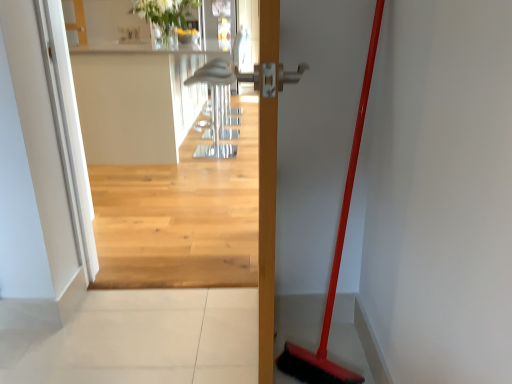
Question: Does white glossy vase at upper center lie in front of red plastic broom at right?

Choices:
 (A) no
 (B) yes

Answer: (A)

Question: Can you confirm if white glossy vase at upper center is thinner than red plastic broom at right?

Choices:
 (A) no
 (B) yes

Answer: (A)

Question: Does white glossy vase at upper center have a smaller size compared to red plastic broom at right?

Choices:
 (A) yes
 (B) no

Answer: (B)

Question: Can you see white glossy vase at upper center touching red plastic broom at right?

Choices:
 (A) yes
 (B) no

Answer: (B)

Question: Is white glossy vase at upper center bigger than red plastic broom at right?

Choices:
 (A) no
 (B) yes

Answer: (B)

Question: Can you confirm if white glossy vase at upper center is positioned to the left of red plastic broom at right?

Choices:
 (A) no
 (B) yes

Answer: (B)

Question: Considering the relative positions of red plastic broom at right and white glossy vase at upper center in the image provided, is red plastic broom at right behind white glossy vase at upper center?

Choices:
 (A) yes
 (B) no

Answer: (B)

Question: Is red plastic broom at right facing towards white glossy vase at upper center?

Choices:
 (A) no
 (B) yes

Answer: (A)

Question: Is white glossy vase at upper center at the back of red plastic broom at right?

Choices:
 (A) yes
 (B) no

Answer: (B)

Question: Is the position of red plastic broom at right less distant than that of white glossy vase at upper center?

Choices:
 (A) yes
 (B) no

Answer: (A)

Question: Would you say red plastic broom at right is outside white glossy vase at upper center?

Choices:
 (A) yes
 (B) no

Answer: (A)

Question: Is red plastic broom at right shorter than white glossy vase at upper center?

Choices:
 (A) no
 (B) yes

Answer: (A)

Question: From the image's perspective, is white glossy vase at upper center located above or below red plastic broom at right?

Choices:
 (A) below
 (B) above

Answer: (B)